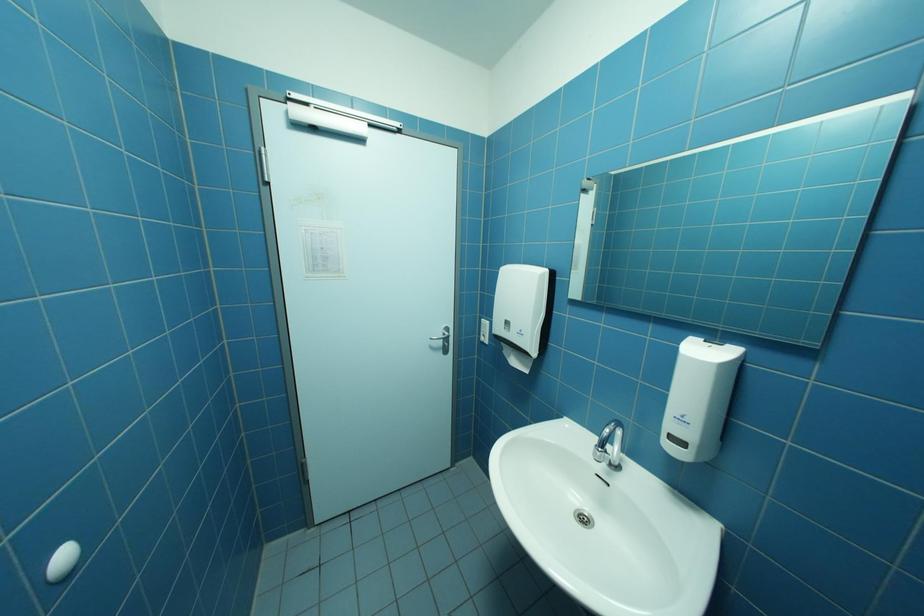
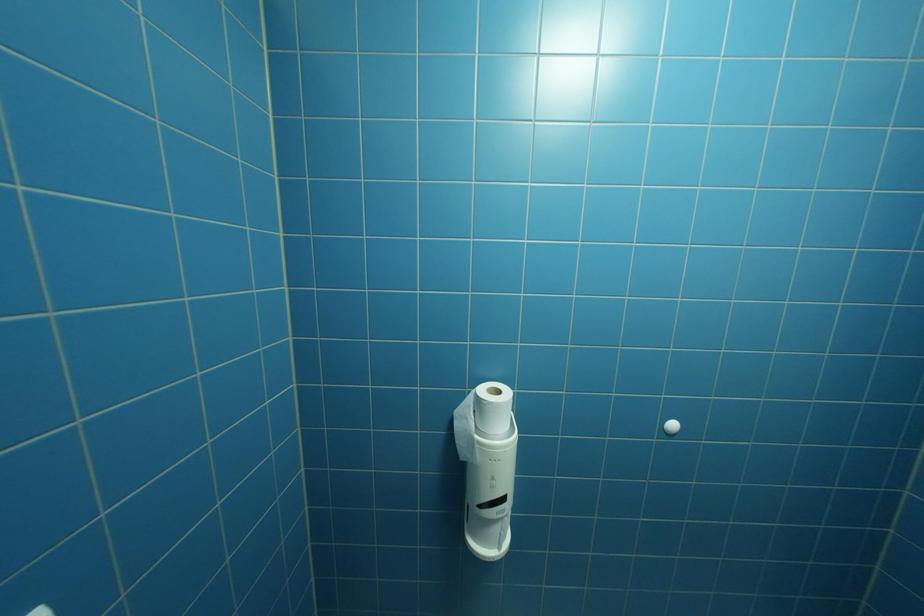
Question: The camera is either moving clockwise (left) or counter-clockwise (right) around the object. The first image is from the beginning of the video and the second image is from the end. Is the camera moving left or right when shooting the video?

Choices:
 (A) Left
 (B) Right

Answer: (B)